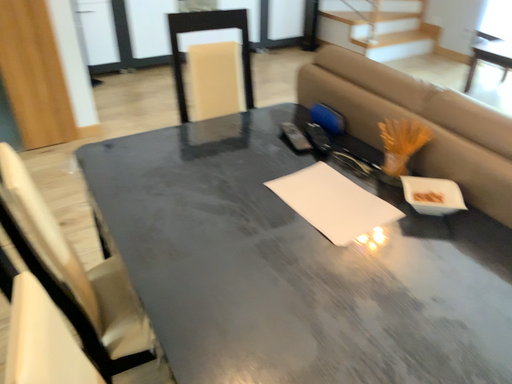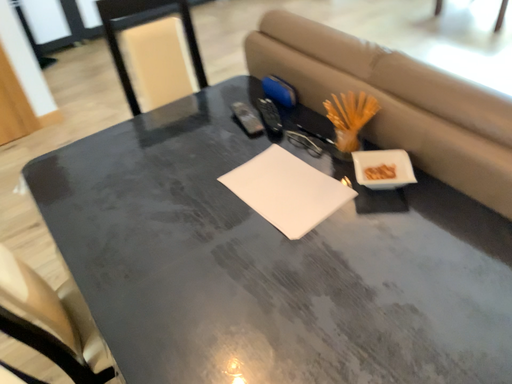
Question: Which way did the camera rotate in the video?

Choices:
 (A) rotated downward
 (B) rotated upward

Answer: (A)